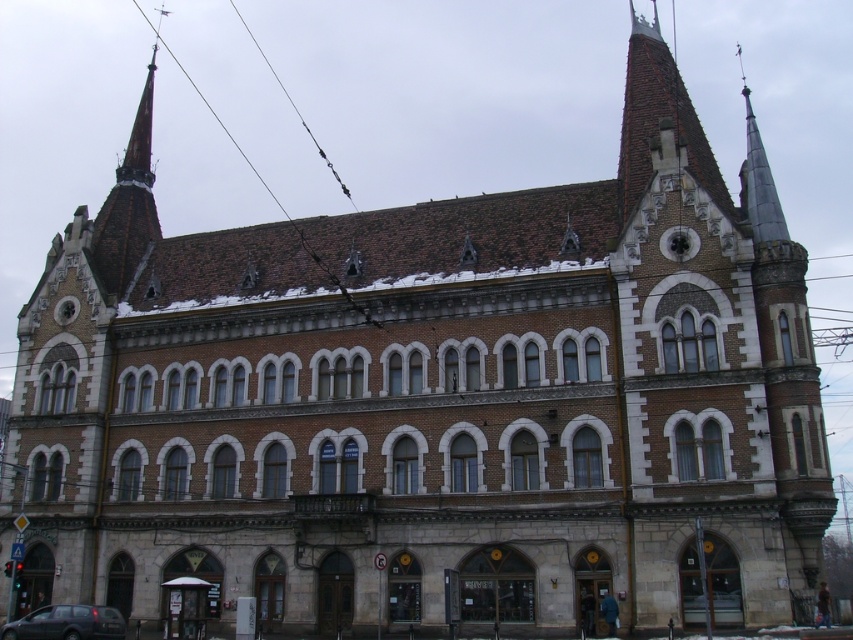
You are standing at the entrance of the grand building and want to park your car. The parking lot is located at the lower left corner of the image. There is already a dark gray metallic van at lower left. Based on the van location, can you estimate where the parking lot is?

The dark gray metallic van at lower left is positioned at point (67, 624), which indicates that the parking lot is likely located at the lower left corner of the image near the van.

You are a delivery driver approaching the grand building and need to park your dark gray metallic van at lower left. There is a brown wire at upper center that you must avoid. Which direction should you move your van to park safely?

You should move your dark gray metallic van at lower left to the right to avoid the brown wire at upper center since the van is currently positioned to the left of the wire.